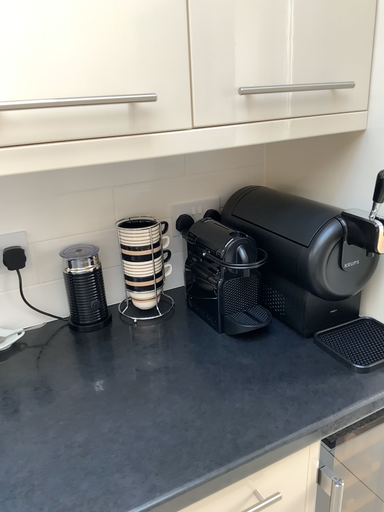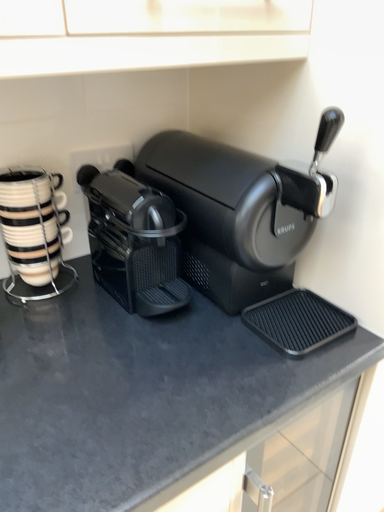
Question: Which way did the camera rotate in the video?

Choices:
 (A) rotated upward
 (B) rotated downward

Answer: (B)